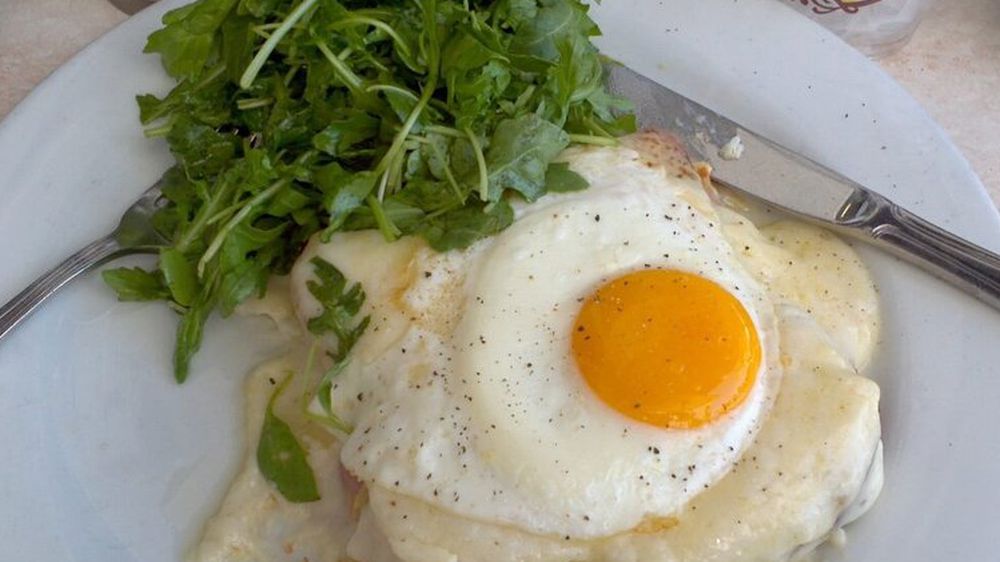
Locate an element on the screen. This screenshot has width=1000, height=562. round part of white plate is located at coordinates (63, 67), (877, 66), (984, 194).